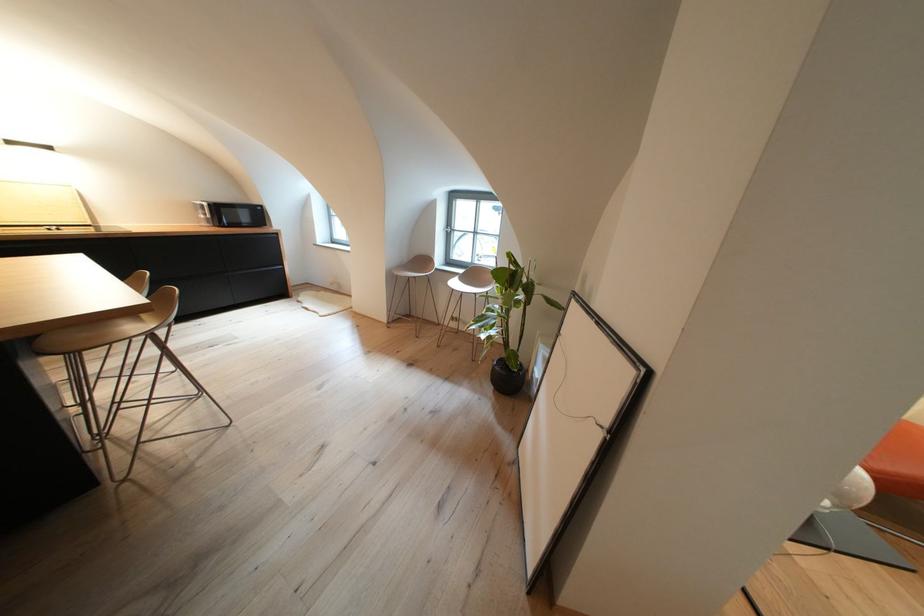
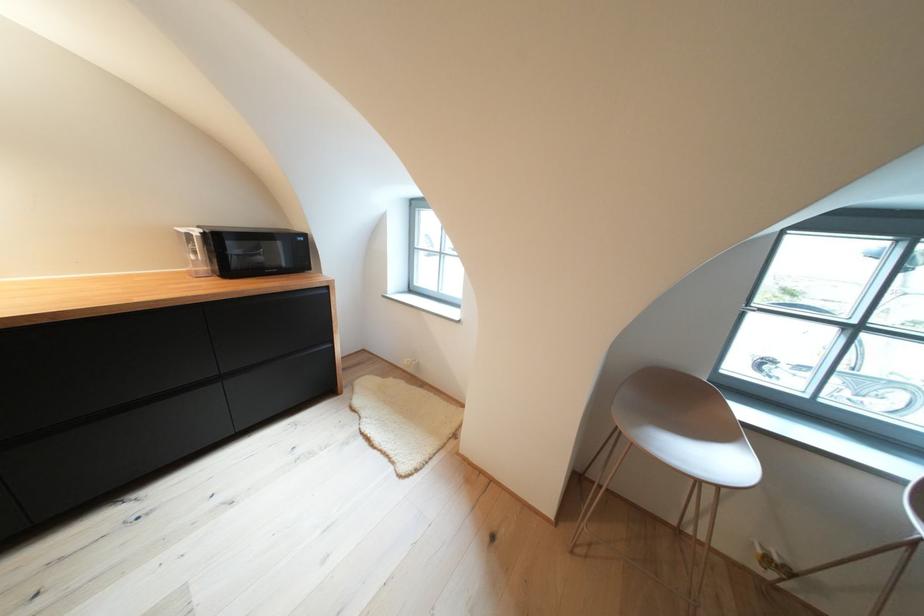
In a continuous first-person perspective shot, in which direction is the camera moving?

The cameraman moved toward left, forward.